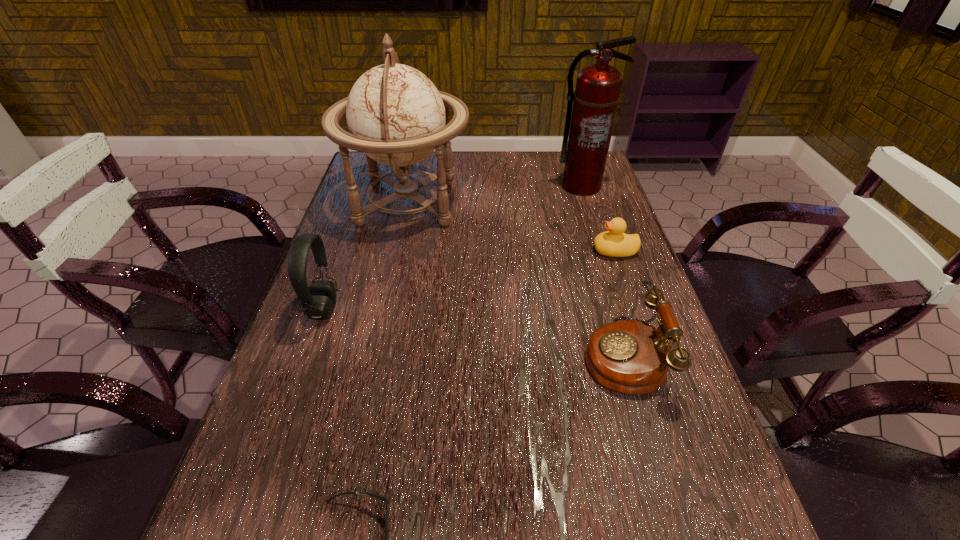
This screenshot has width=960, height=540. I want to click on telephone present at the right edge, so click(632, 357).

Where is `duck present at the right edge`? This screenshot has width=960, height=540. duck present at the right edge is located at coordinates tap(614, 243).

This screenshot has width=960, height=540. In order to click on object present at the far left corner in this screenshot , I will do (396, 116).

At what (x,y) coordinates should I click in order to perform the action: click on object located at the far right corner. Please return your answer as a coordinate pair (x, y). Looking at the image, I should click on (597, 93).

Where is `vacant space at the far edge of the desktop`? The height and width of the screenshot is (540, 960). vacant space at the far edge of the desktop is located at coordinates (474, 173).

I want to click on free space at the left edge of the desktop, so click(x=346, y=326).

Locate an element on the screen. This screenshot has width=960, height=540. blank space at the right edge is located at coordinates (568, 195).

The height and width of the screenshot is (540, 960). Identify the location of vacant space at the far left corner. (367, 184).

You are a GUI agent. You are given a task and a screenshot of the screen. Output one action in this format:
    pyautogui.click(x=<x>, y=<y>)
    Task: Click on the unoccupied area between the globe and the fire extinguisher
    The image size is (960, 540).
    Given the screenshot: What is the action you would take?
    pyautogui.click(x=493, y=193)

The image size is (960, 540). Identify the location of empty space that is in between the fire extinguisher and the globe. (493, 193).